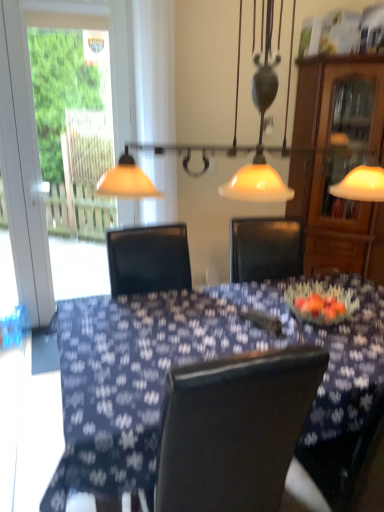
Question: Is transparent glass screen door at left positioned with its back to matte glass pendant light at upper center?

Choices:
 (A) yes
 (B) no

Answer: (B)

Question: Is transparent glass screen door at left far from matte glass pendant light at upper center?

Choices:
 (A) no
 (B) yes

Answer: (A)

Question: Can you confirm if transparent glass screen door at left is bigger than matte glass pendant light at upper center?

Choices:
 (A) yes
 (B) no

Answer: (B)

Question: Does transparent glass screen door at left have a smaller size compared to matte glass pendant light at upper center?

Choices:
 (A) no
 (B) yes

Answer: (B)

Question: From the image's perspective, does transparent glass screen door at left appear lower than matte glass pendant light at upper center?

Choices:
 (A) no
 (B) yes

Answer: (B)

Question: Is transparent glass screen door at left positioned before matte glass pendant light at upper center?

Choices:
 (A) yes
 (B) no

Answer: (B)

Question: Is blue fabric table at center oriented towards transparent glass screen door at left?

Choices:
 (A) yes
 (B) no

Answer: (B)

Question: Is blue fabric table at center to the left of transparent glass screen door at left from the viewer's perspective?

Choices:
 (A) no
 (B) yes

Answer: (A)

Question: Does blue fabric table at center have a smaller size compared to transparent glass screen door at left?

Choices:
 (A) no
 (B) yes

Answer: (A)

Question: Is blue fabric table at center bigger than transparent glass screen door at left?

Choices:
 (A) yes
 (B) no

Answer: (A)

Question: Does blue fabric table at center have a lesser height compared to transparent glass screen door at left?

Choices:
 (A) no
 (B) yes

Answer: (B)

Question: Is blue fabric table at center closer to the viewer compared to transparent glass screen door at left?

Choices:
 (A) no
 (B) yes

Answer: (B)

Question: Can you confirm if matte glass pendant light at upper center is thinner than blue fabric table at center?

Choices:
 (A) no
 (B) yes

Answer: (B)